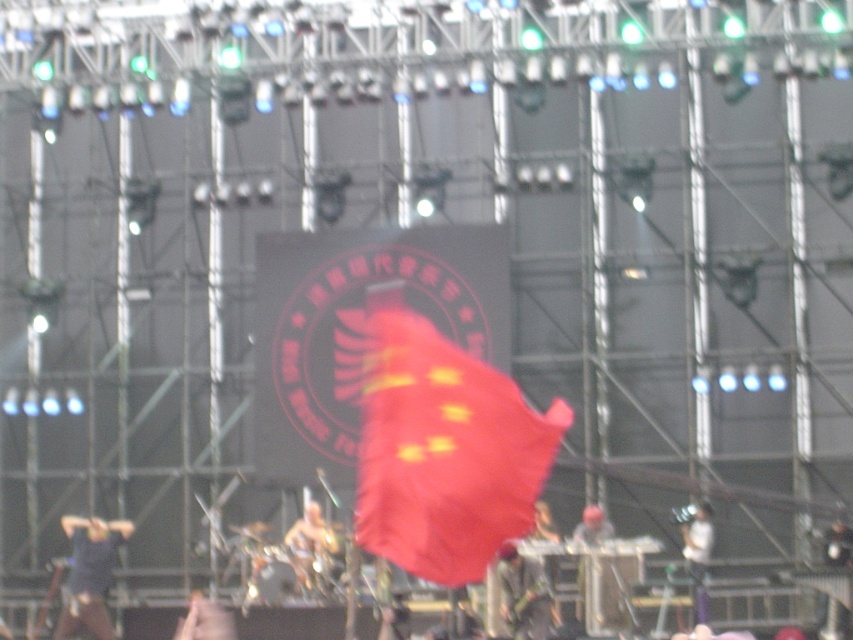
You are a photographer at the concert. You need to capture a photo where both the dark gray fabric at lower center and the smooth white shirt at center are clearly visible. Which object should you focus on to ensure both are in sharp focus?

You should focus on the dark gray fabric at lower center because it is bigger and closer to the camera than the smooth white shirt at center, ensuring both will be in focus.